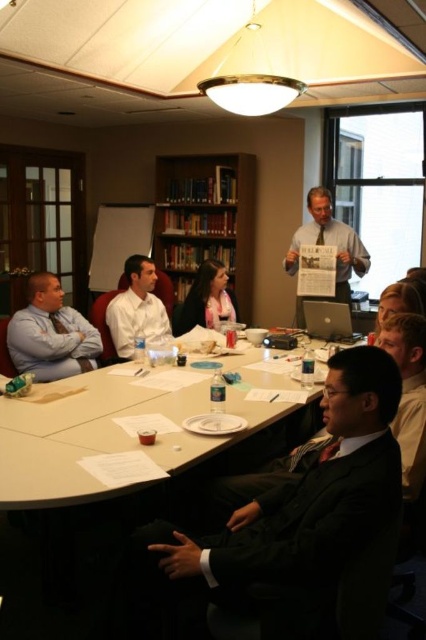
Consider the image. Is dark suit at center to the right of white shirt at upper center from the viewer's perspective?

No, dark suit at center is not to the right of white shirt at upper center.

Can you confirm if dark suit at center is shorter than white shirt at upper center?

Indeed, dark suit at center has a lesser height compared to white shirt at upper center.

Does point (348, 502) lie behind point (336, 237)?

No, it is in front of (336, 237).

Where is `dark suit at center`? dark suit at center is located at coordinates (305, 512).

Is white shirt at upper center closer to the viewer compared to white shirt at center?

No, white shirt at upper center is behind white shirt at center.

From the picture: Can you confirm if white shirt at upper center is taller than white shirt at center?

Yes, white shirt at upper center is taller than white shirt at center.

Where is `white shirt at upper center`? The width and height of the screenshot is (426, 640). white shirt at upper center is located at coordinates (330, 243).

Does white shirt at center lie behind light brown hair at center?

No, white shirt at center is in front of light brown hair at center.

Is white shirt at center smaller than light brown hair at center?

Incorrect, white shirt at center is not smaller in size than light brown hair at center.

Which is behind, point (124, 317) or point (204, 278)?

The point (204, 278) is behind.

Locate an element on the screen. This screenshot has height=640, width=426. white shirt at center is located at coordinates (137, 308).